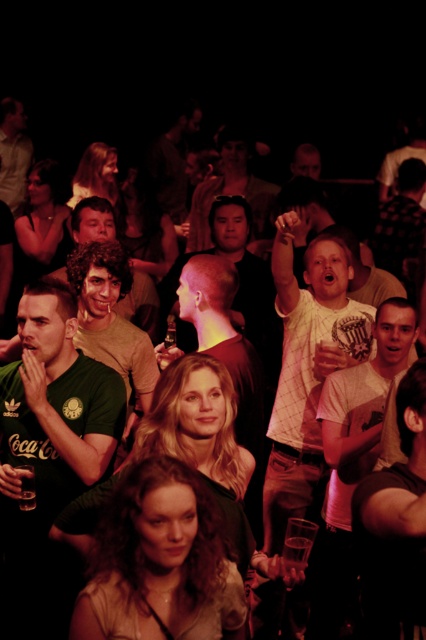
Is smooth skin head at center smaller than dark brown leather jacket at center?

No, smooth skin head at center is not smaller than dark brown leather jacket at center.

Does smooth skin head at center have a lesser height compared to dark brown leather jacket at center?

Yes, smooth skin head at center is shorter than dark brown leather jacket at center.

Is point (242, 253) farther from camera compared to point (186, 196)?

No, it is in front of (186, 196).

I want to click on smooth skin head at center, so click(238, 280).

Is white t-shirt at center above green jersey at center?

Actually, white t-shirt at center is below green jersey at center.

Does point (293, 289) lie behind point (127, 401)?

No, it is in front of (127, 401).

Find the location of `white t-shirt at center`. white t-shirt at center is located at coordinates (307, 369).

Measure the distance between green jersey at center and camera.

green jersey at center is 3.87 meters from camera.

Is green jersey at center bigger than dark brown leather jacket at center?

No, green jersey at center is not bigger than dark brown leather jacket at center.

Who is more forward, (77, 262) or (173, 154)?

Point (77, 262) is more forward.

Find the location of a particular element. This screenshot has height=640, width=426. green jersey at center is located at coordinates (111, 317).